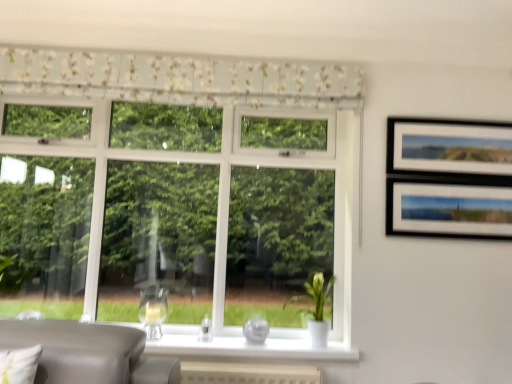
Question: Is the surface of floral fabric valance at upper center in direct contact with transparent glass vase at center?

Choices:
 (A) yes
 (B) no

Answer: (B)

Question: Considering the relative sizes of floral fabric valance at upper center and transparent glass vase at center in the image provided, is floral fabric valance at upper center bigger than transparent glass vase at center?

Choices:
 (A) no
 (B) yes

Answer: (B)

Question: Is floral fabric valance at upper center turned away from transparent glass vase at center?

Choices:
 (A) no
 (B) yes

Answer: (A)

Question: From the image's perspective, would you say floral fabric valance at upper center is shown under transparent glass vase at center?

Choices:
 (A) no
 (B) yes

Answer: (A)

Question: Is floral fabric valance at upper center shorter than transparent glass vase at center?

Choices:
 (A) yes
 (B) no

Answer: (B)

Question: In the image, is floral fabric valance at upper center positioned in front of or behind transparent glass vase at center?

Choices:
 (A) front
 (B) behind

Answer: (A)

Question: Does point (246, 89) appear closer or farther from the camera than point (266, 324)?

Choices:
 (A) farther
 (B) closer

Answer: (B)

Question: From the image's perspective, is floral fabric valance at upper center located above or below transparent glass vase at center?

Choices:
 (A) below
 (B) above

Answer: (B)

Question: Considering the relative positions of floral fabric valance at upper center and transparent glass vase at center in the image provided, is floral fabric valance at upper center to the left or to the right of transparent glass vase at center?

Choices:
 (A) right
 (B) left

Answer: (B)

Question: Considering the relative positions of transparent glass vase at center and white glossy vase at lower center in the image provided, is transparent glass vase at center to the left or to the right of white glossy vase at lower center?

Choices:
 (A) right
 (B) left

Answer: (B)

Question: From the image's perspective, is transparent glass vase at center above or below white glossy vase at lower center?

Choices:
 (A) below
 (B) above

Answer: (A)

Question: Looking at the image, does transparent glass vase at center seem bigger or smaller compared to white glossy vase at lower center?

Choices:
 (A) big
 (B) small

Answer: (B)

Question: From a real-world perspective, is transparent glass vase at center positioned above or below white glossy vase at lower center?

Choices:
 (A) below
 (B) above

Answer: (A)

Question: Considering the relative positions of white glossy vase at lower center and floral fabric valance at upper center in the image provided, is white glossy vase at lower center to the left or to the right of floral fabric valance at upper center?

Choices:
 (A) left
 (B) right

Answer: (B)

Question: Is point (318, 271) positioned closer to the camera than point (359, 74)?

Choices:
 (A) farther
 (B) closer

Answer: (A)